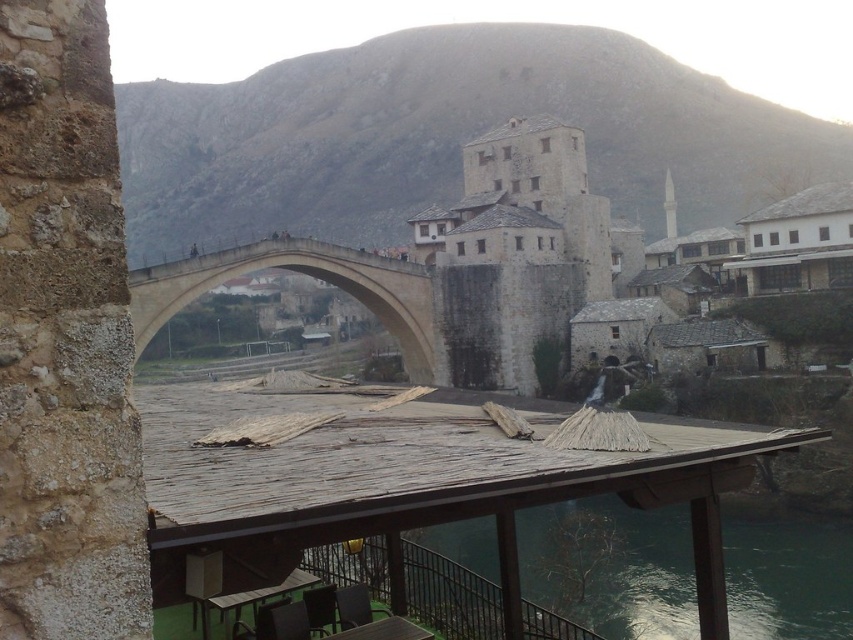
Question: In this image, where is beige stone bridge at center located relative to white stone tower at center?

Choices:
 (A) below
 (B) above

Answer: (A)

Question: Which object appears farthest from the camera in this image?

Choices:
 (A) beige stone bridge at center
 (B) greenish water at lower center

Answer: (B)

Question: Can you confirm if beige stone bridge at center is thinner than white stone tower at center?

Choices:
 (A) yes
 (B) no

Answer: (B)

Question: Which is farther from the greenish water at lower center?

Choices:
 (A) beige stone bridge at center
 (B) white stone tower at center

Answer: (B)

Question: Is greenish water at lower center below white stone tower at center?

Choices:
 (A) no
 (B) yes

Answer: (B)

Question: Among these objects, which one is farthest from the camera?

Choices:
 (A) white stone tower at center
 (B) beige stone bridge at center

Answer: (A)